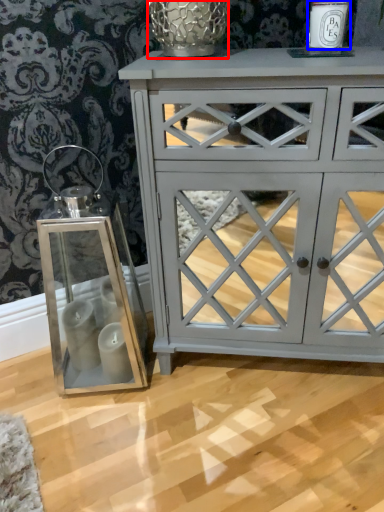
Question: Which object is closer to the camera taking this photo, glass vase (highlighted by a red box) or candle holder (highlighted by a blue box)?

Choices:
 (A) glass vase
 (B) candle holder

Answer: (B)